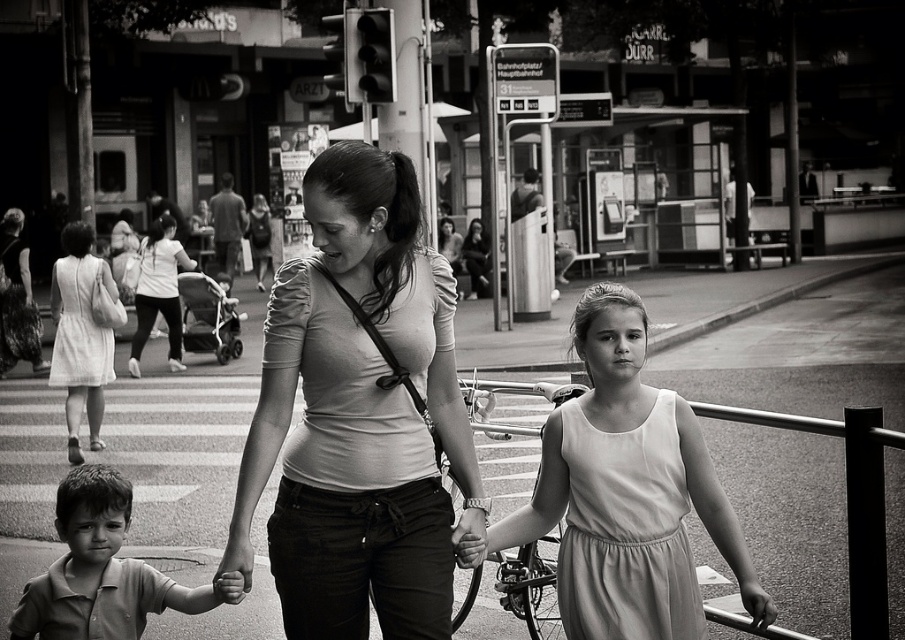
Question: Which object is closer to the camera taking this photo?

Choices:
 (A) light beige fabric dress at center
 (B) matte white shirt at center

Answer: (B)

Question: Which of the following is the closest to the observer?

Choices:
 (A) (410, 404)
 (B) (143, 618)
 (C) (498, 547)

Answer: (A)

Question: Does matte white shirt at center come behind light beige fabric dress at center?

Choices:
 (A) yes
 (B) no

Answer: (B)

Question: Is matte white shirt at center positioned at the back of light beige fabric dress at center?

Choices:
 (A) no
 (B) yes

Answer: (A)

Question: Does matte white shirt at center have a lesser width compared to smooth cotton shirt at lower left?

Choices:
 (A) no
 (B) yes

Answer: (B)

Question: Based on their relative distances, which object is nearer to the light beige fabric dress at center?

Choices:
 (A) smooth cotton shirt at lower left
 (B) matte white shirt at center

Answer: (B)